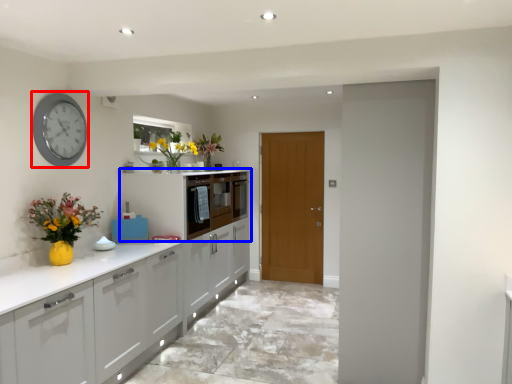
Question: Which of the following is the closest to the observer, clock (highlighted by a red box) or cabinetry (highlighted by a blue box)?

Choices:
 (A) clock
 (B) cabinetry

Answer: (A)